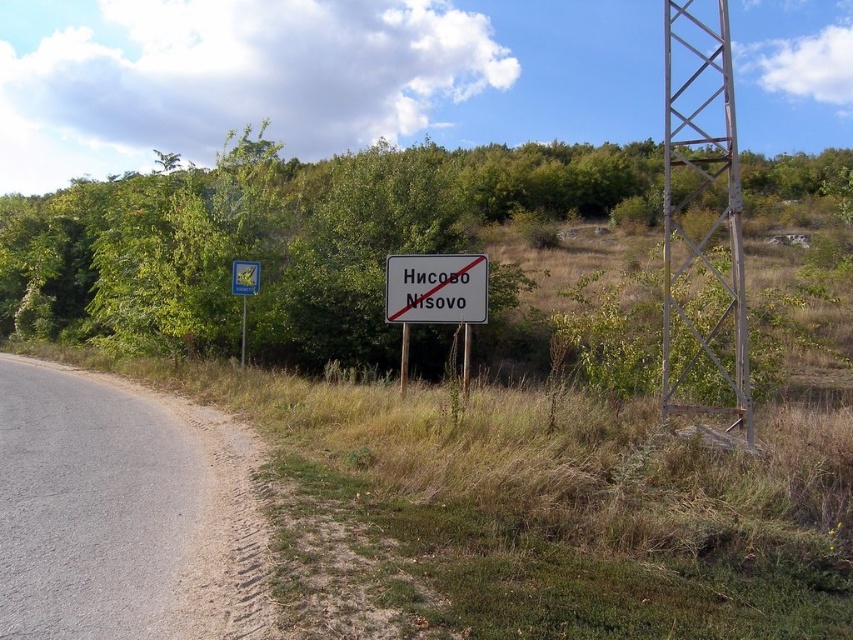
You are standing at the center of the road in the rural scene. You see a green leafy tree at center. Which direction should you walk to reach the tree?

The green leafy tree at center is located directly in front of you since it is at the center of the image, so you should walk straight ahead to reach it.

Consider the image. You are standing at the center of the road in the rural scene. You need to locate the gray metallic sign at center. According to the coordinates provided, where exactly should you look to find it?

The gray metallic sign at center is located at the 2D coordinates point (436, 289), so you should look towards the center of the image where those coordinates point to find it.